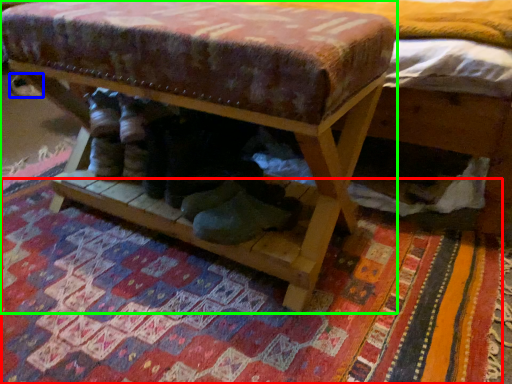
Question: Which object is the farthest from mat (highlighted by a red box)? Choose among these: shoe (highlighted by a blue box) or furniture (highlighted by a green box).

Choices:
 (A) shoe
 (B) furniture

Answer: (A)